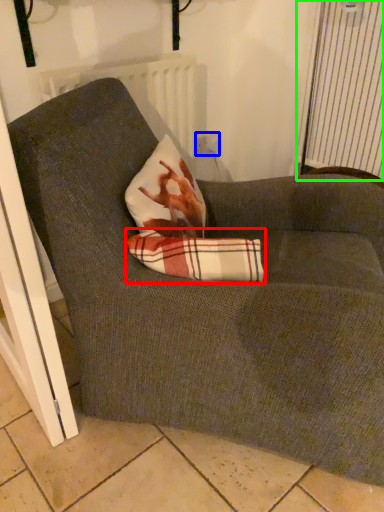
Question: Which object is the farthest from plaid (highlighted by a red box)? Choose among these: electric outlet (highlighted by a blue box) or curtain (highlighted by a green box).

Choices:
 (A) electric outlet
 (B) curtain

Answer: (B)